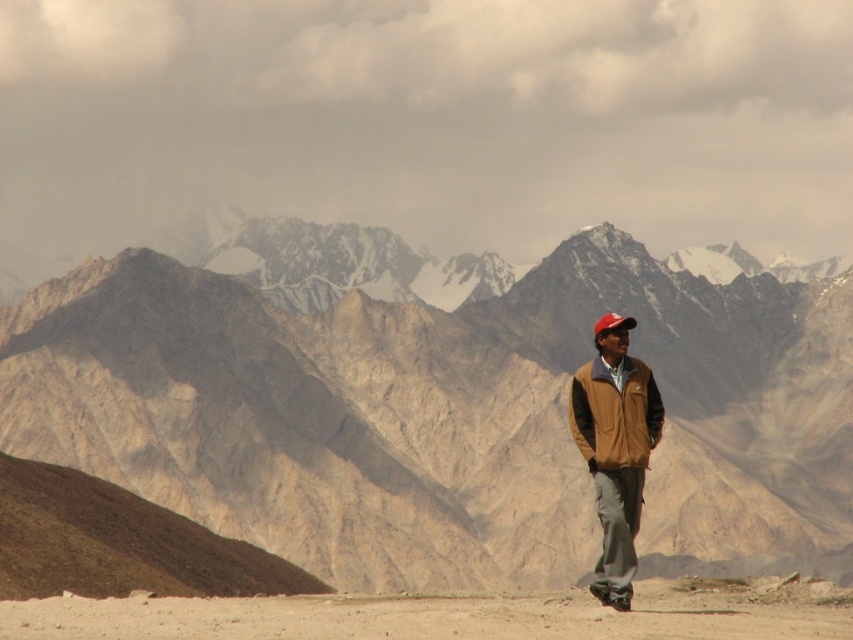
Question: Does desert sand at lower center appear under red matte cap at center?

Choices:
 (A) yes
 (B) no

Answer: (A)

Question: Which is farther from the brown suede jacket at center?

Choices:
 (A) rugged stone mountain range at center
 (B) red matte cap at center
 (C) desert sand at lower center

Answer: (A)

Question: Does rugged stone mountain range at center have a larger size compared to brown fleece jacket at lower right?

Choices:
 (A) no
 (B) yes

Answer: (B)

Question: Among these points, which one is farthest from the camera?

Choices:
 (A) (602, 557)
 (B) (608, 458)
 (C) (703, 600)
 (D) (543, 467)

Answer: (D)

Question: Among these points, which one is farthest from the camera?

Choices:
 (A) (270, 310)
 (B) (622, 502)

Answer: (A)

Question: Can you confirm if brown suede jacket at center is positioned below red matte cap at center?

Choices:
 (A) no
 (B) yes

Answer: (B)